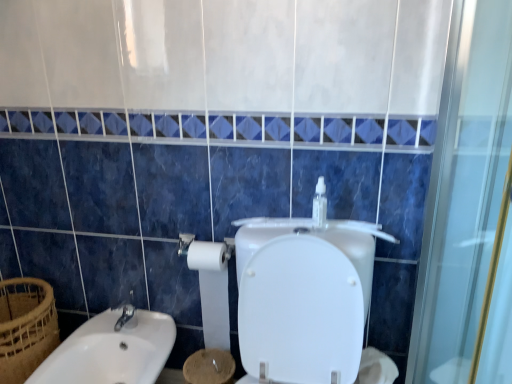
Question: Considering the relative positions of brown woven basket at lower left and clear plastic bottle at upper center in the image provided, is brown woven basket at lower left to the left of clear plastic bottle at upper center from the viewer's perspective?

Choices:
 (A) no
 (B) yes

Answer: (B)

Question: Is brown woven basket at lower left closer to camera compared to clear plastic bottle at upper center?

Choices:
 (A) no
 (B) yes

Answer: (A)

Question: From a real-world perspective, is brown woven basket at lower left physically below clear plastic bottle at upper center?

Choices:
 (A) yes
 (B) no

Answer: (A)

Question: Can you confirm if brown woven basket at lower left is taller than clear plastic bottle at upper center?

Choices:
 (A) no
 (B) yes

Answer: (B)

Question: Does brown woven basket at lower left have a larger size compared to clear plastic bottle at upper center?

Choices:
 (A) no
 (B) yes

Answer: (B)

Question: Based on their sizes in the image, would you say white matte toilet paper at lower center, the first toilet paper when ordered from left to right, is bigger or smaller than white glossy sink at lower left?

Choices:
 (A) big
 (B) small

Answer: (B)

Question: From the image's perspective, relative to white glossy sink at lower left, is white matte toilet paper at lower center, acting as the second toilet paper starting from the right, above or below?

Choices:
 (A) below
 (B) above

Answer: (B)

Question: Considering their positions, is white matte toilet paper at lower center, acting as the second toilet paper starting from the right, located in front of or behind white glossy sink at lower left?

Choices:
 (A) front
 (B) behind

Answer: (B)

Question: From a real-world perspective, is white matte toilet paper at lower center, acting as the second toilet paper starting from the right, above or below white glossy sink at lower left?

Choices:
 (A) above
 (B) below

Answer: (A)

Question: From the image's perspective, is clear plastic bottle at upper center above or below white glossy sink at lower left?

Choices:
 (A) below
 (B) above

Answer: (B)

Question: Based on their positions, is clear plastic bottle at upper center located to the left or right of white glossy sink at lower left?

Choices:
 (A) right
 (B) left

Answer: (A)

Question: Is point (323, 203) closer or farther from the camera than point (87, 369)?

Choices:
 (A) closer
 (B) farther

Answer: (A)

Question: From their relative heights in the image, would you say clear plastic bottle at upper center is taller or shorter than white glossy sink at lower left?

Choices:
 (A) short
 (B) tall

Answer: (A)

Question: Does point (374, 349) appear closer or farther from the camera than point (316, 193)?

Choices:
 (A) farther
 (B) closer

Answer: (A)

Question: From a real-world perspective, is white matte toilet paper at lower right, which is the first toilet paper in right-to-left order, physically located above or below clear plastic bottle at upper center?

Choices:
 (A) above
 (B) below

Answer: (B)